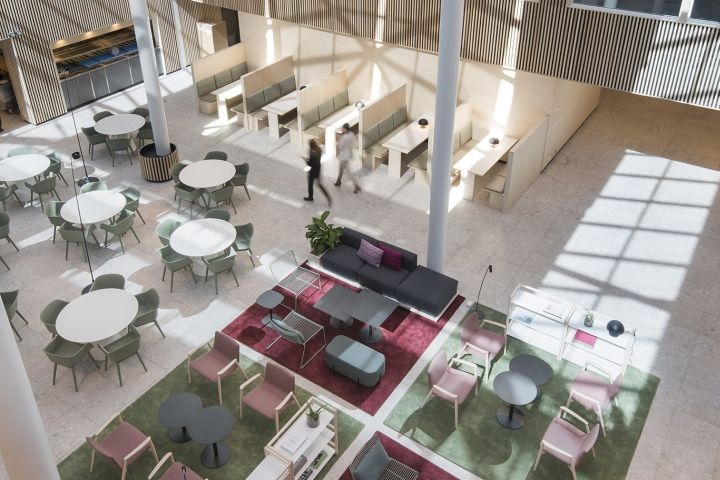
Locate an element on the screen. pinkish arm chair is located at coordinates (260, 399), (214, 362), (127, 442), (171, 472), (454, 386), (484, 341), (595, 383), (564, 444).